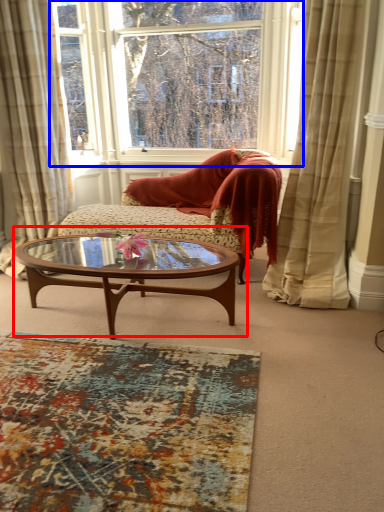
Question: Which object appears closest to the camera in this image, coffee table (highlighted by a red box) or window (highlighted by a blue box)?

Choices:
 (A) coffee table
 (B) window

Answer: (A)